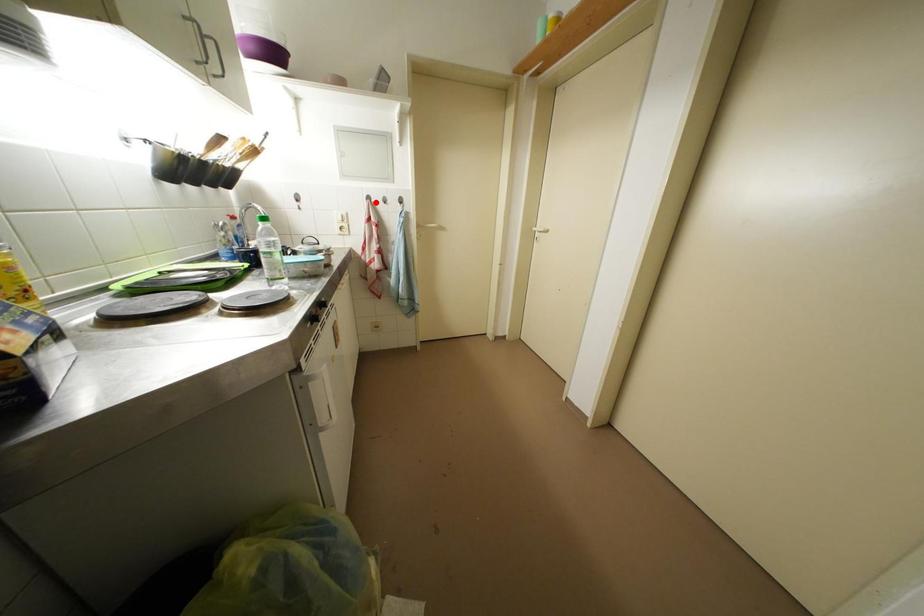
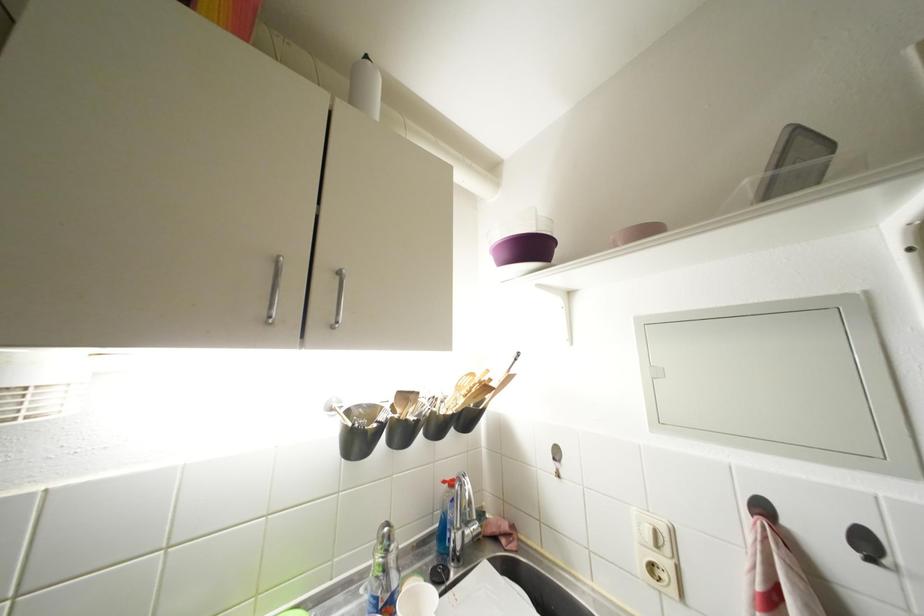
The point at the highlighted location is marked in the first image. Where is the corresponding point in the second image?

(770, 513)